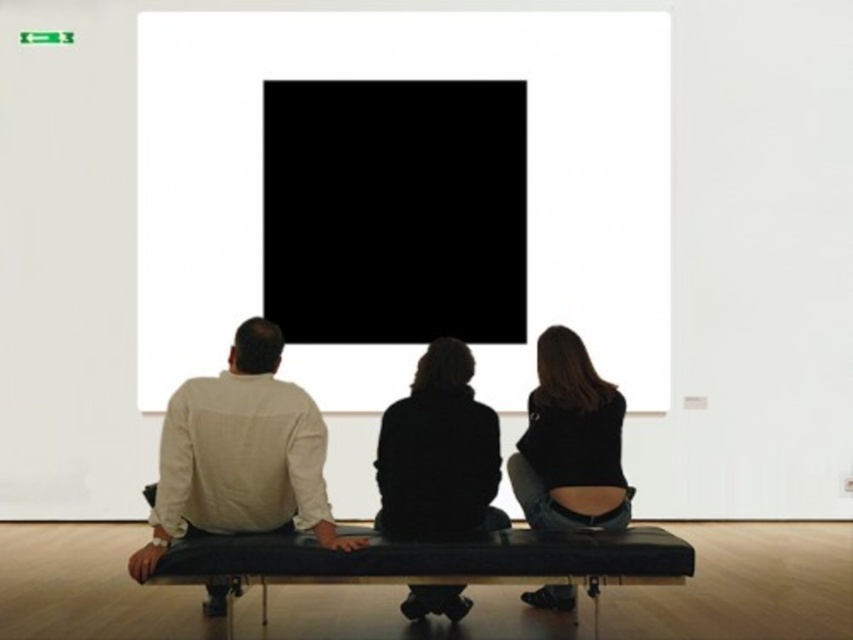
You are an art enthusiast standing in the gallery and want to sit on the black leather bench at center to view the art installation more comfortably. Given that the bench is at coordinates point 0.878, 0.508, can you determine if you can comfortably sit on it without moving other visitors?

The black leather bench at center is located at point (432, 561), so yes, you can comfortably sit there as the coordinates indicate its position in the gallery. However, ensure that there is enough space and that other visitors are not already occupying the bench.

You are standing in the art gallery and want to take a photo of the two points mentioned. Which point, point [677,544] or point [608,488], will appear larger in your camera view?

Point [677,544] is closer to the camera than point [608,488], so it will appear larger in the camera view.

You are standing in an art gallery and want to get a closer look at the large white square frame surrounding a black square. The point where you are currently standing is labeled as point [248,340]. If you move forward 3 meters, will you be able to touch the artwork?

The point [248,340] and the viewer are 3.14 meters apart. Moving forward 3 meters would leave you approximately 0.14 meters away from the artwork, so you would still be too far to touch it.